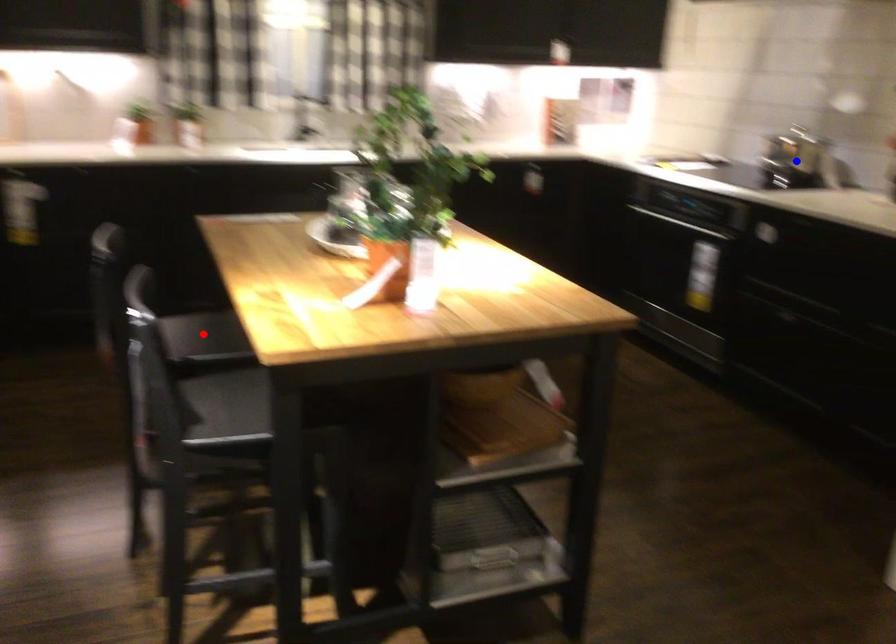
Question: In the image, two points are highlighted. Which point is nearer to the camera? Reply with the corresponding letter.

Choices:
 (A) blue point
 (B) red point

Answer: (B)